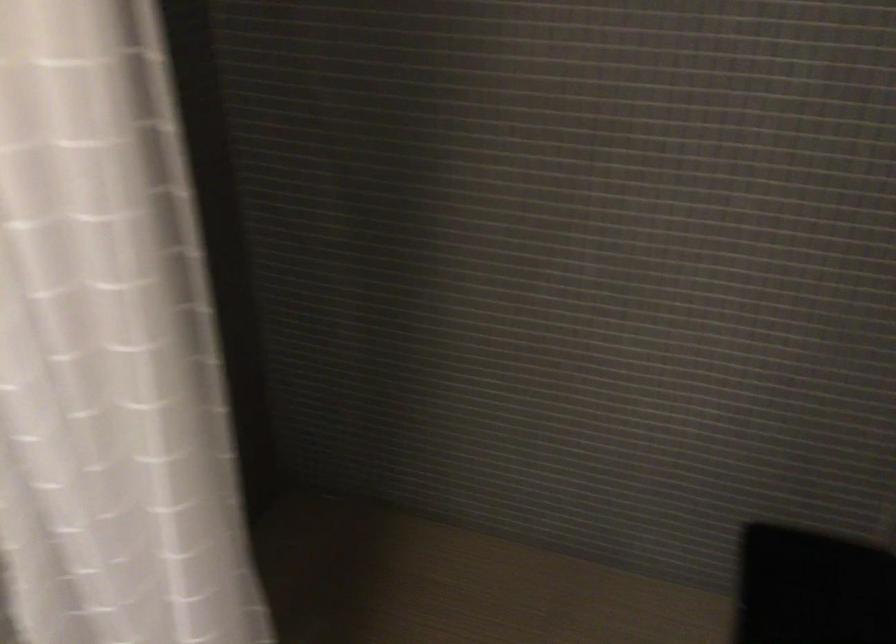
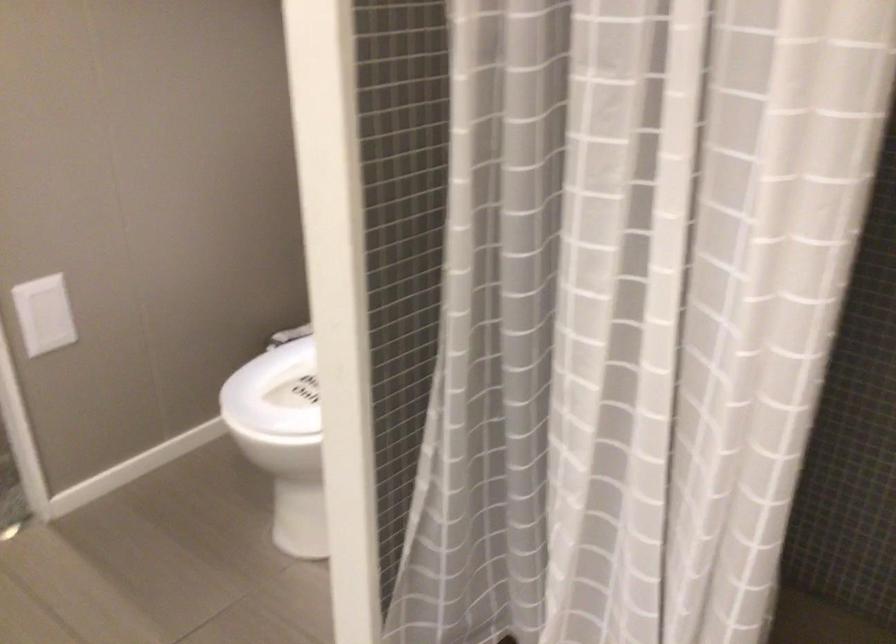
Question: The images are taken continuously from a first-person perspective. In which direction is your viewpoint rotating?

Choices:
 (A) Left
 (B) Right
 (C) Up
 (D) Down

Answer: (A)